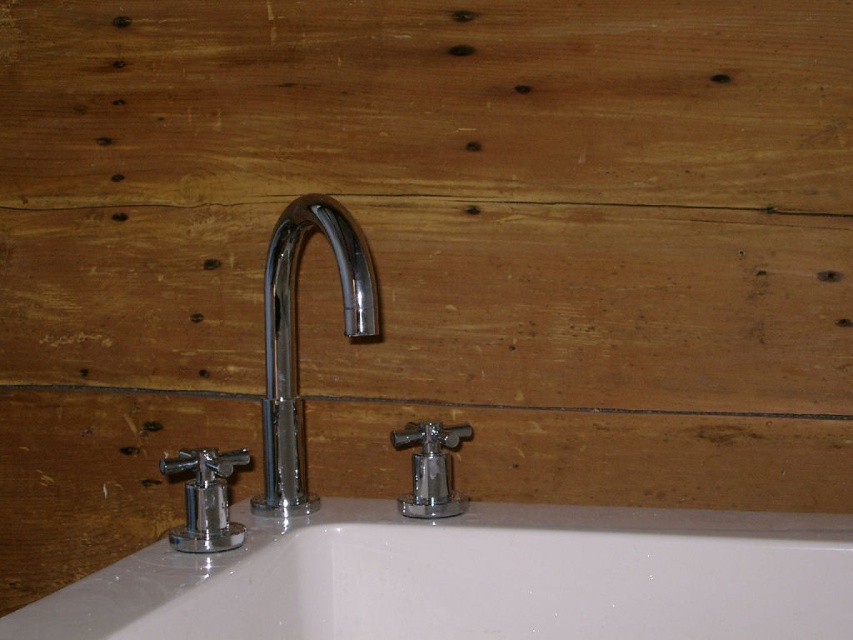
Question: Which point is closer to the camera taking this photo?

Choices:
 (A) (306, 228)
 (B) (733, 602)

Answer: (B)

Question: Among these objects, which one is nearest to the camera?

Choices:
 (A) white glossy bath at center
 (B) chrome/metallic faucet at center

Answer: (A)

Question: Does white glossy bath at center appear on the right side of chrome/metallic faucet at center?

Choices:
 (A) yes
 (B) no

Answer: (A)

Question: Is white glossy bath at center smaller than chrome/metallic faucet at center?

Choices:
 (A) yes
 (B) no

Answer: (B)

Question: Can you confirm if white glossy bath at center is positioned to the right of chrome/metallic faucet at center?

Choices:
 (A) no
 (B) yes

Answer: (B)

Question: Which of the following is the farthest from the observer?

Choices:
 (A) white glossy bath at center
 (B) chrome/metallic faucet at center

Answer: (B)